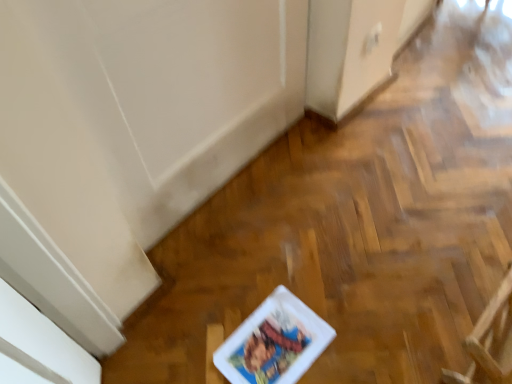
Identify the location of vacant area to the right of white glossy comic book at center. Image resolution: width=512 pixels, height=384 pixels. (352, 323).